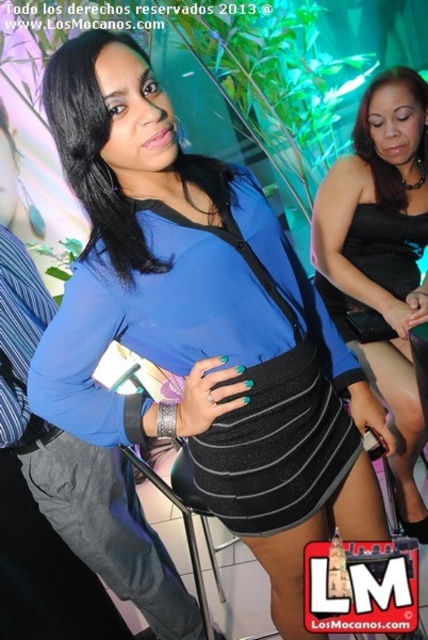
You are at a social event and notice two outfits worn by attendees. The black satin dress at center and the matte blue top at center. Based on their positions, which one is located to the right side of the other?

The black satin dress at center is to the right of the matte blue top at center.

Based on the photo, you are at a party and want to take a photo of the matte blue top at center without the black satin dress at center blocking it. How should you position yourself?

The matte blue top at center is behind the black satin dress at center, so you should move behind the black satin dress at center to take the photo so the matte blue top at center is visible without obstruction.

You are a fashion designer observing the woman in the image. You need to determine the vertical positioning of her clothing items. Which item, the black matte skirt at center or the matte blue top at center, extends higher upwards?

The black matte skirt at center extends higher upwards than the matte blue top at center, as it is much taller.